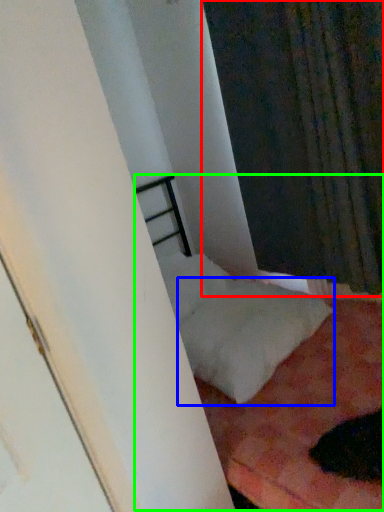
Question: Which object is the farthest from curtain (highlighted by a red box)? Choose among these: pillow (highlighted by a blue box) or bed (highlighted by a green box).

Choices:
 (A) pillow
 (B) bed

Answer: (B)